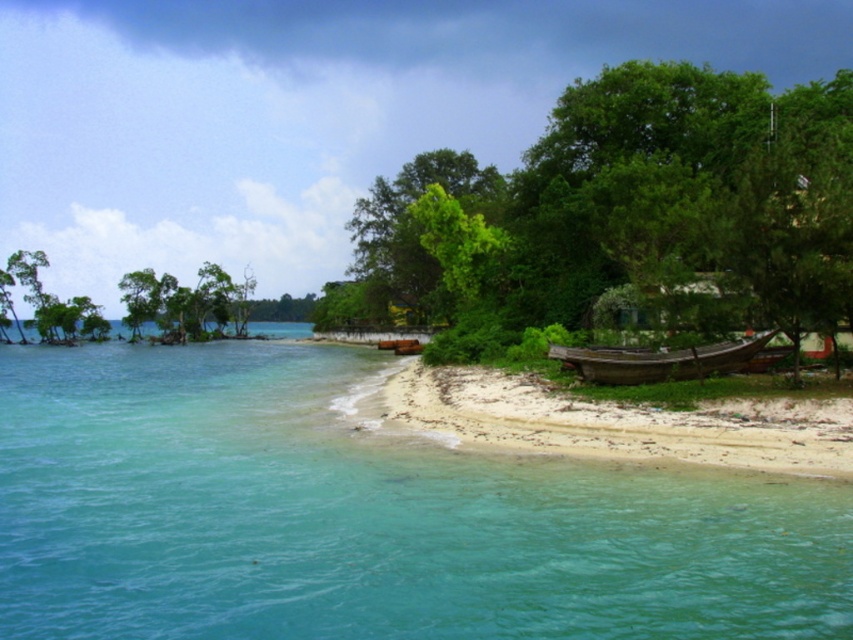
You are standing on the white sandy beach at lower right and want to climb up to the green leafy tree at upper center. Is the climb going to be easy or difficult?

The white sandy beach at lower right has a lesser height compared to green leafy tree at upper center, so the climb might be difficult because the tree is taller.

From the picture: You are standing on the white sandy beach at lower right and want to reach the wooden boat at right. Which direction should you walk to get there?

Since the white sandy beach at lower right is to the left of the wooden boat at right, you should walk to the right to reach the wooden boat at right.

You are planning to build a small sandcastle on the beach. Given that the white sandy beach at lower right is narrower than the clear blue water at lower left, where would you have more space to build your sandcastle? Please explain your reasoning based on the scene description.

The white sandy beach at lower right is narrower than the clear blue water at lower left. Since sandcastles are typically built on sandy beaches, the narrower beach area would provide less space for building. Therefore, you would have more space to build your sandcastle on the white sandy beach at lower right if it were wider, but according to the description, it is narrower. Wait, there seems to be a contradiction here. Let me recheck the details. The Objects Description states that the clear blue water at